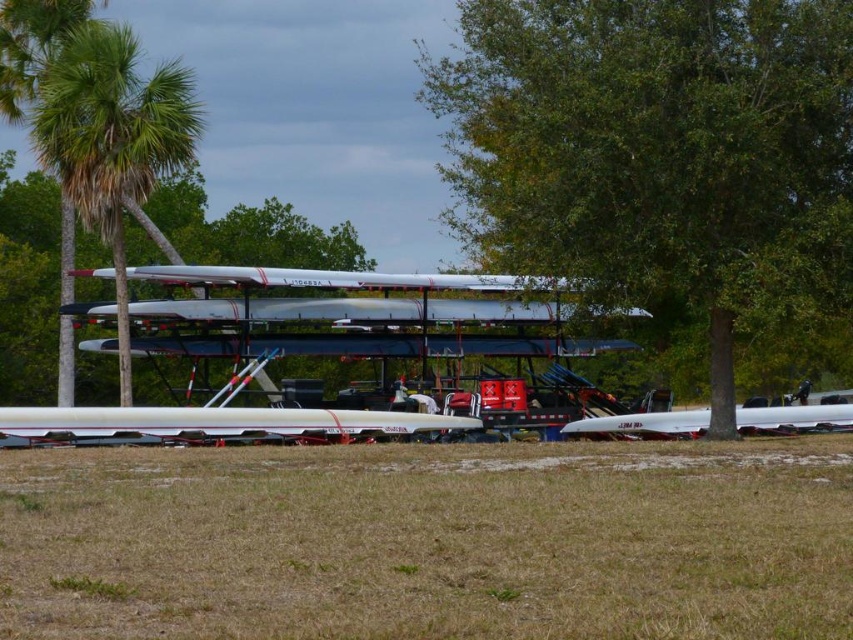
You are standing in the outdoor area and want to take a photo of the green leafy palm tree at left and the white matte boat at lower right. Which object will appear taller in the photo?

The green leafy palm tree at left will appear taller in the photo because it has a greater height compared to the white matte boat at lower right.

You are standing at the center of the grassy area and want to walk towards the green leafy tree at center. Which direction should you head?

The green leafy tree at center is located at point 0.236 on the x and 0.770 on the y axis, so you should head towards the upper left direction from your current position at the center.